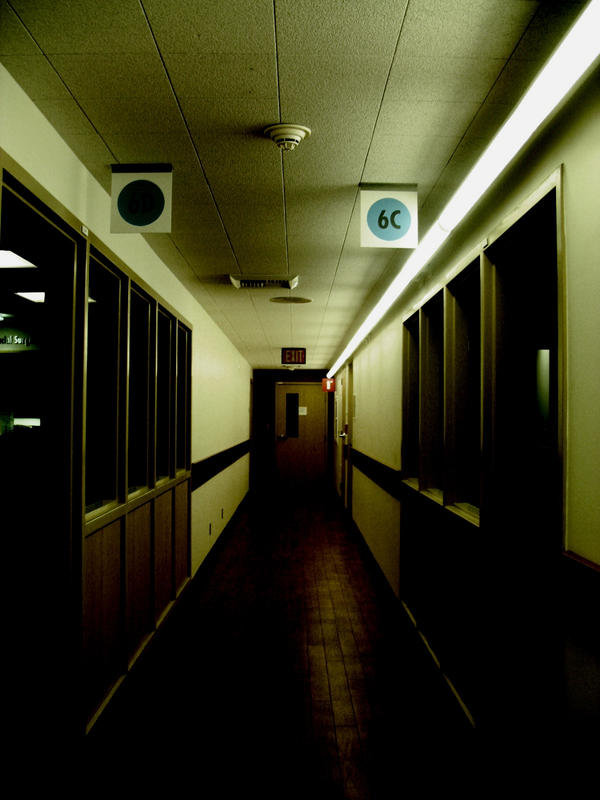
Locate an element on the screen. This screenshot has height=800, width=600. fire extinguisher sign is located at coordinates (324, 385).